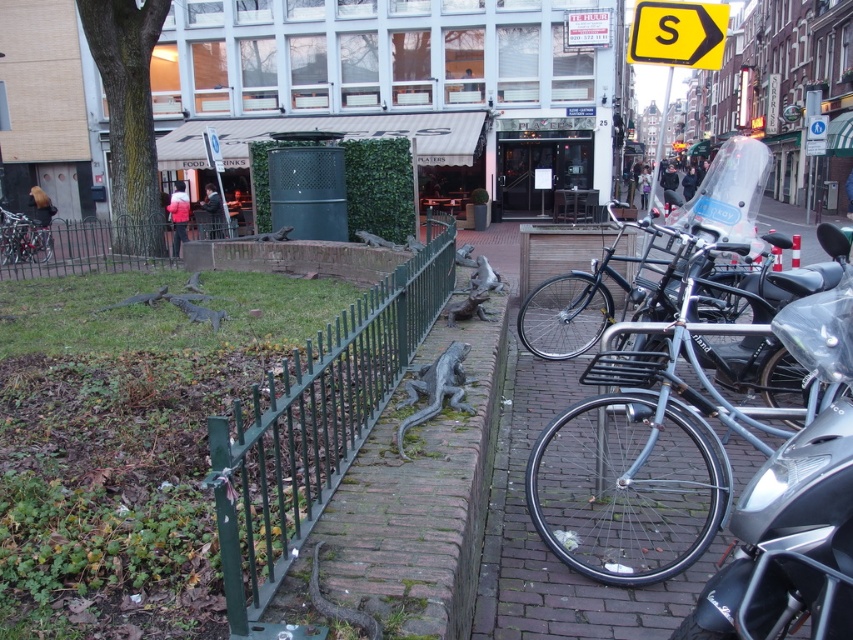
You are standing at the center of the grassy area enclosed by the dark green metal fence. You want to ride your metallic silver bicycle at right to the nearby park entrance located at the opposite end of the street. Which direction should you head from your current position to reach the park entrance?

The metallic silver bicycle at right is located at point (544, 547), so you should head towards the right side of the image to reach the park entrance opposite the street.

You are a delivery person who needs to park your metallic silver bicycle at right near the green metal fence at left. However, there is limited vertical space between the bicycle and the fence. Can you fit the bicycle between the fence and the wall without tilting it?

The metallic silver bicycle at right is taller than the green metal fence at left, so it cannot be placed between the fence and the wall without tilting since the fence is shorter than the bicycle.